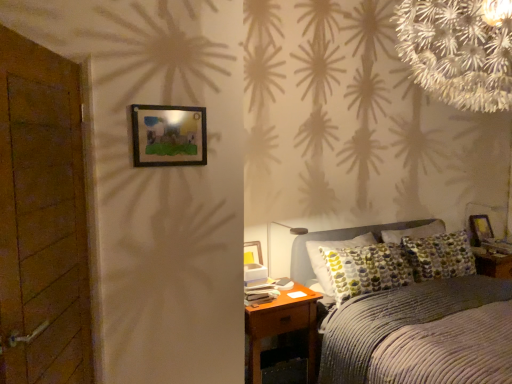
Question: From a real-world perspective, is corduroy bed at center under brown wooden nightstand at lower right?

Choices:
 (A) yes
 (B) no

Answer: (B)

Question: From the image's perspective, is corduroy bed at center located beneath brown wooden nightstand at lower right?

Choices:
 (A) yes
 (B) no

Answer: (B)

Question: Is corduroy bed at center beside brown wooden nightstand at lower right?

Choices:
 (A) no
 (B) yes

Answer: (A)

Question: From the image's perspective, is corduroy bed at center over brown wooden nightstand at lower right?

Choices:
 (A) no
 (B) yes

Answer: (B)

Question: Is corduroy bed at center to the right of brown wooden nightstand at lower right from the viewer's perspective?

Choices:
 (A) yes
 (B) no

Answer: (A)

Question: Considering the relative sizes of corduroy bed at center and brown wooden nightstand at lower right in the image provided, is corduroy bed at center shorter than brown wooden nightstand at lower right?

Choices:
 (A) no
 (B) yes

Answer: (A)

Question: Is wooden door at left completely or partially inside corduroy bed at center?

Choices:
 (A) yes
 (B) no

Answer: (B)

Question: Is the position of corduroy bed at center more distant than that of wooden door at left?

Choices:
 (A) yes
 (B) no

Answer: (A)

Question: From the image's perspective, is corduroy bed at center above wooden door at left?

Choices:
 (A) yes
 (B) no

Answer: (B)

Question: Does corduroy bed at center have a lesser height compared to wooden door at left?

Choices:
 (A) no
 (B) yes

Answer: (B)

Question: From a real-world perspective, is corduroy bed at center on top of wooden door at left?

Choices:
 (A) no
 (B) yes

Answer: (A)

Question: Is corduroy bed at center aimed at wooden door at left?

Choices:
 (A) yes
 (B) no

Answer: (B)

Question: Does wooden door at left turn towards wooden picture frame at right, which ranks as the 1th picture frame in right-to-left order?

Choices:
 (A) yes
 (B) no

Answer: (B)